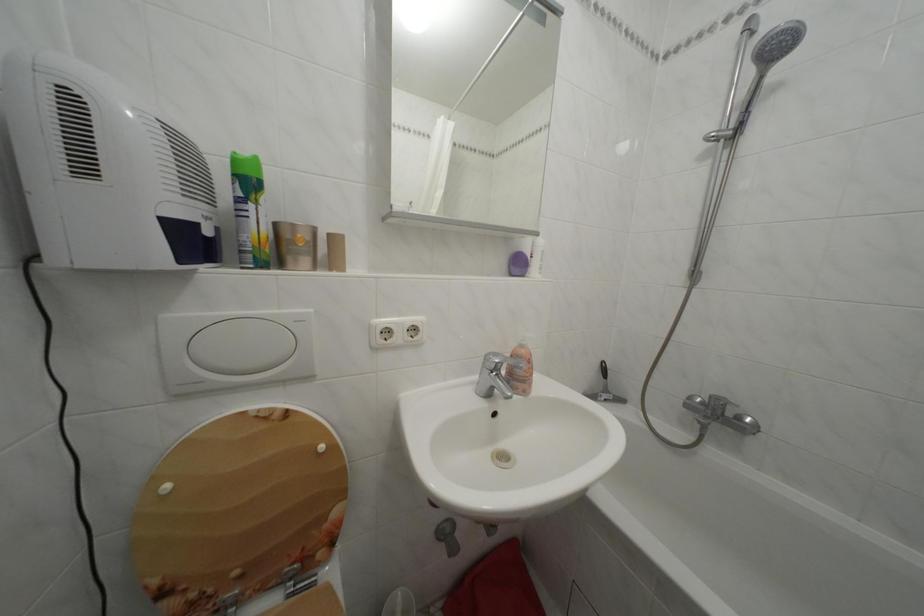
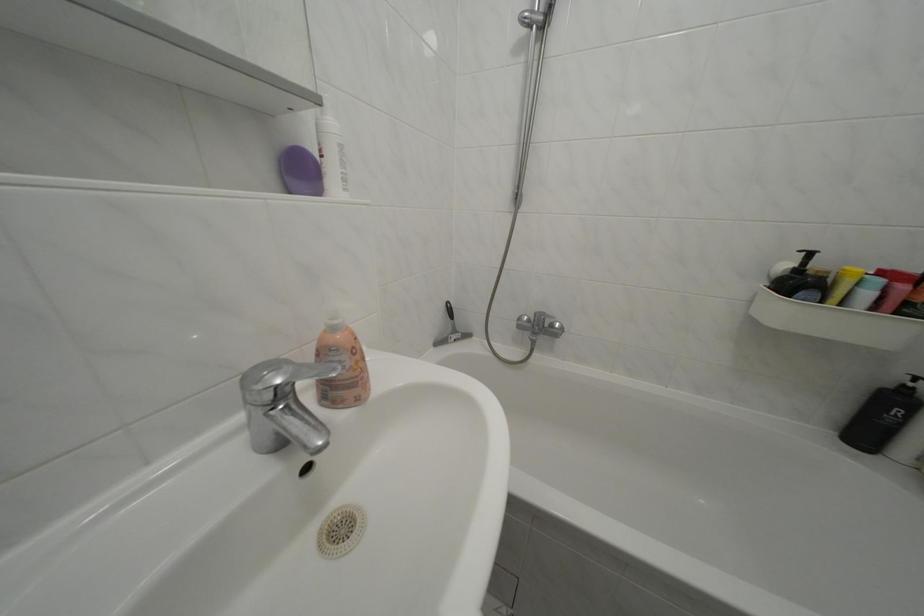
The point at (495,362) is marked in the first image. Where is the corresponding point in the second image?

(252, 384)